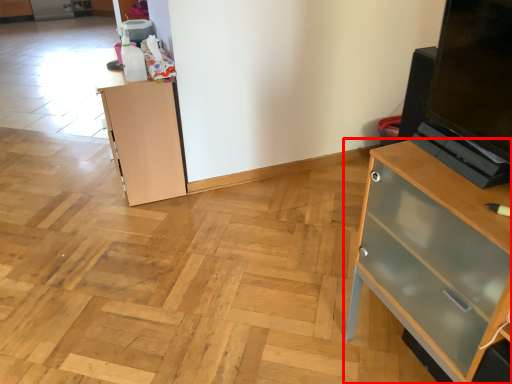
Question: Considering the relative positions of chest of drawers (annotated by the red box) and cupboard in the image provided, where is chest of drawers (annotated by the red box) located with respect to the staircase?

Choices:
 (A) left
 (B) right

Answer: (B)